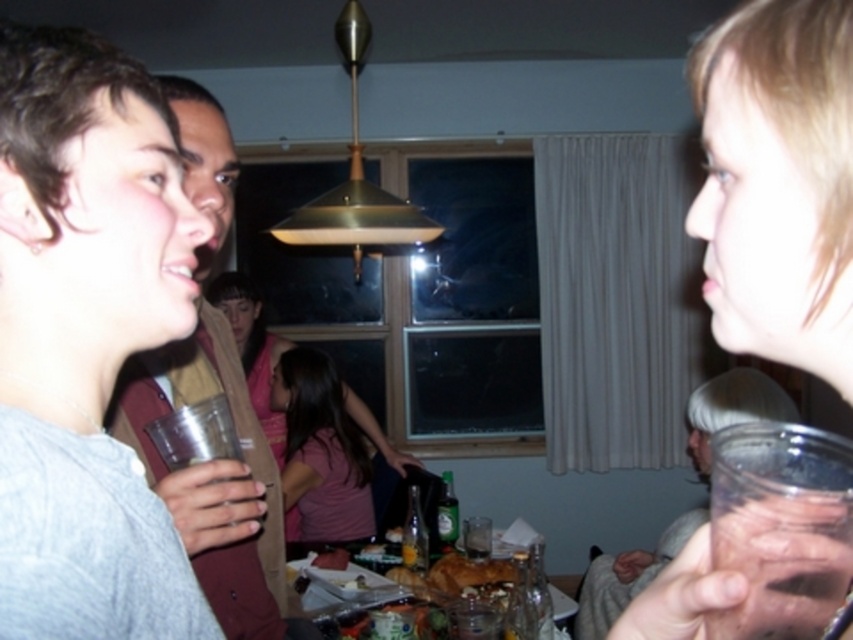
Question: Does gray knit sweater at left have a larger size compared to translucent plastic cup at upper right?

Choices:
 (A) yes
 (B) no

Answer: (A)

Question: Among these points, which one is farthest from the camera?

Choices:
 (A) (248, 548)
 (B) (807, 188)

Answer: (A)

Question: Does gray knit sweater at left appear on the left side of matte brown jacket at left?

Choices:
 (A) yes
 (B) no

Answer: (B)

Question: Which object is closer to the camera taking this photo?

Choices:
 (A) matte brown jacket at left
 (B) translucent plastic cup at upper right
 (C) translucent plastic cup at lower right

Answer: (B)

Question: Can you confirm if matte brown jacket at left is wider than pink fabric shirt at center?

Choices:
 (A) yes
 (B) no

Answer: (B)

Question: Among these points, which one is farthest from the camera?

Choices:
 (A) (630, 572)
 (B) (788, 307)

Answer: (A)